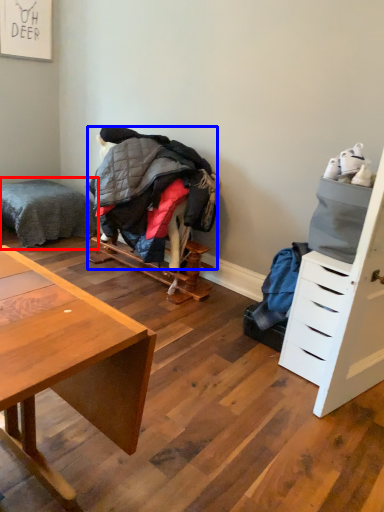
Question: Which point is further to the camera, bed (highlighted by a red box) or clothing (highlighted by a blue box)?

Choices:
 (A) bed
 (B) clothing

Answer: (A)